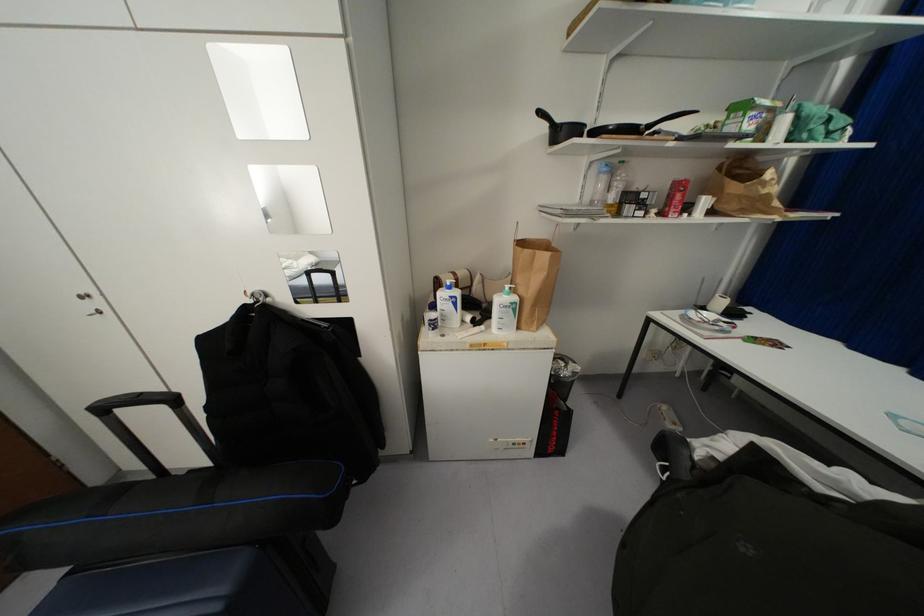
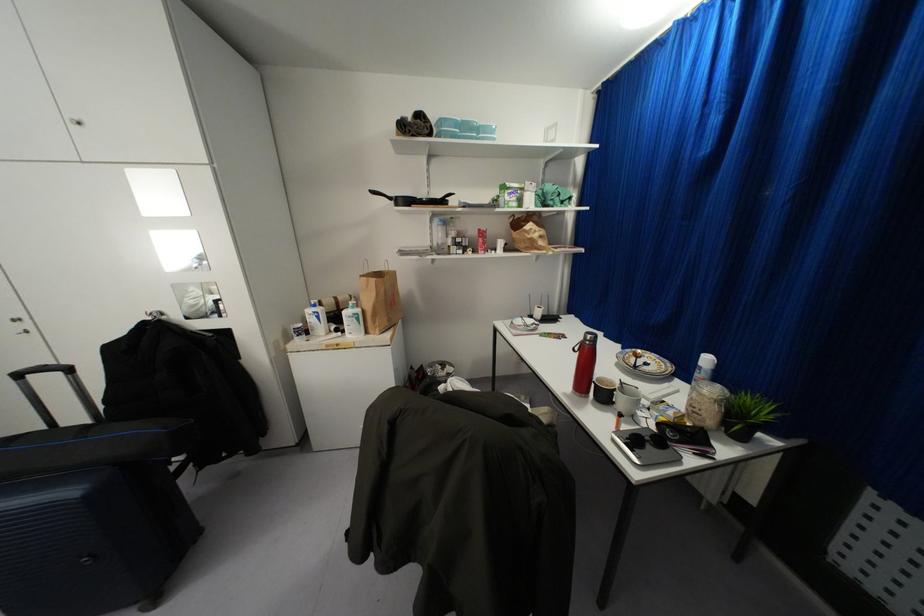
In a continuous first-person perspective shot, in which direction is the camera moving?

The cameraman moved toward right, backward.